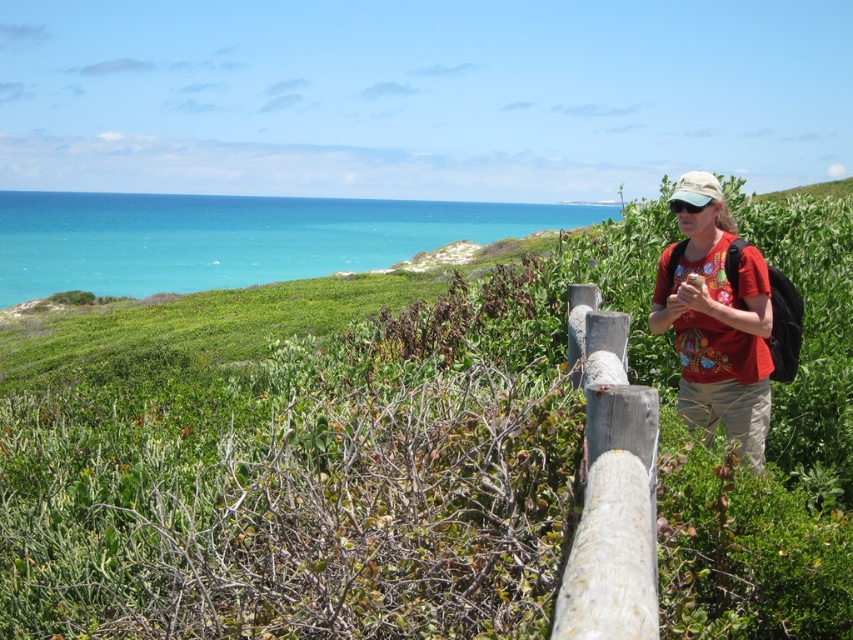
Between green leafy grass at center and weathered wood fence at right, which one appears on the right side from the viewer's perspective?

weathered wood fence at right

Locate an element on the screen. green leafy grass at center is located at coordinates (409, 458).

Is green leafy grass at center smaller than red cotton shirt at center?

No, green leafy grass at center is not smaller than red cotton shirt at center.

Between green leafy grass at center and red cotton shirt at center, which one is positioned lower?

green leafy grass at center is below.

Is point (763, 595) positioned in front of point (747, 291)?

Yes, point (763, 595) is in front of point (747, 291).

Identify the location of green leafy grass at center. (409, 458).

Is weathered wood fence at right in front of red cotton shirt at center?

Yes, weathered wood fence at right is closer to the viewer.

Is point (589, 410) positioned before point (762, 442)?

That is True.

The width and height of the screenshot is (853, 640). Identify the location of weathered wood fence at right. (610, 486).